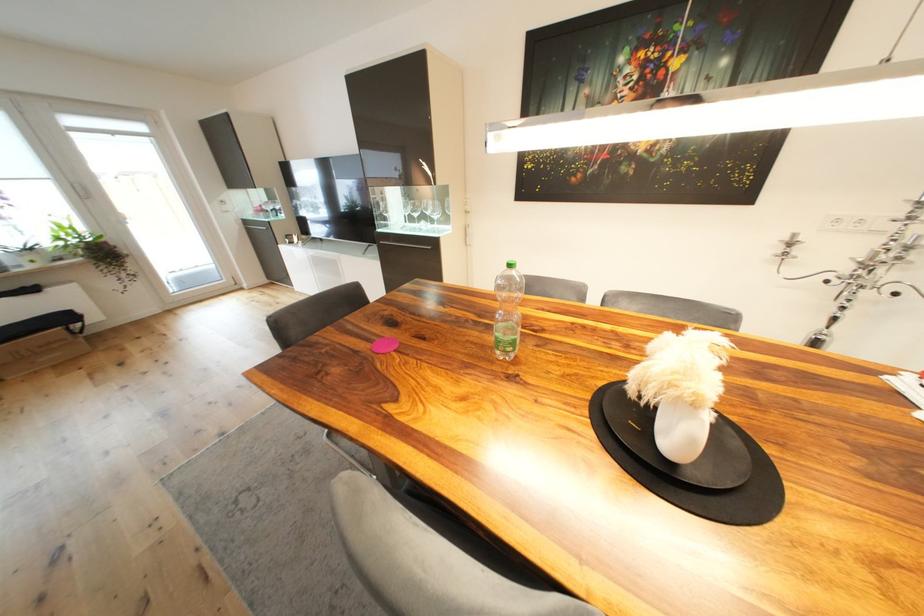
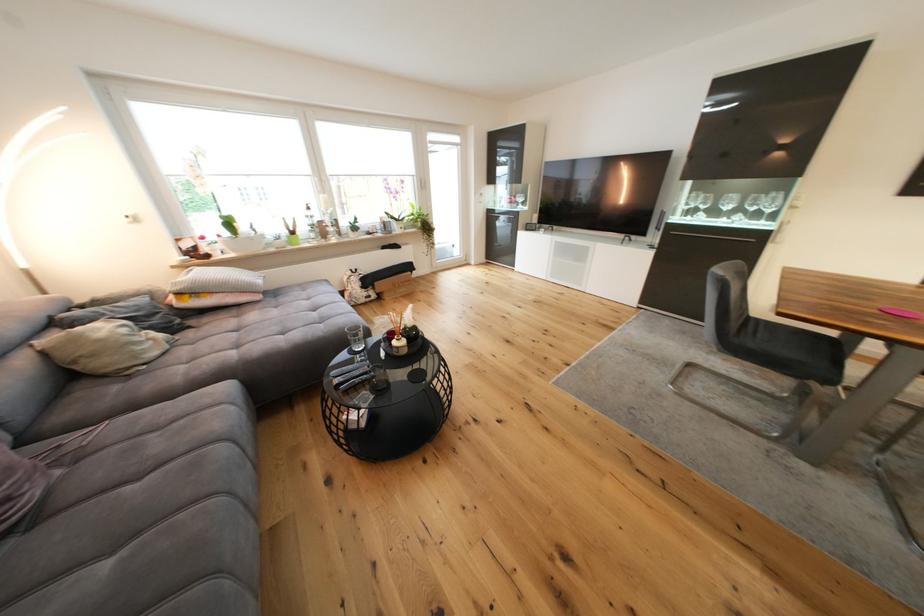
The images are taken continuously from a first-person perspective. In which direction are you moving?

The cameraman walked toward left, backward.